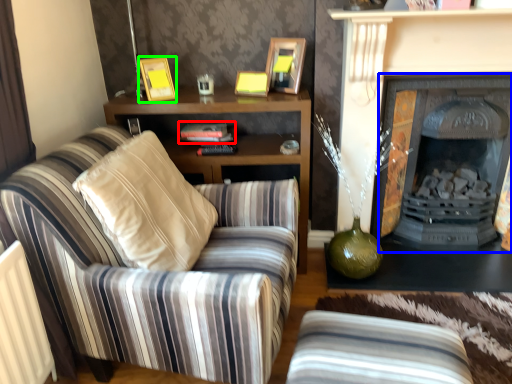
Question: Based on their relative distances, which object is nearer to book (highlighted by a red box)? Choose from fireplace (highlighted by a blue box) and picture frame (highlighted by a green box).

Choices:
 (A) fireplace
 (B) picture frame

Answer: (B)